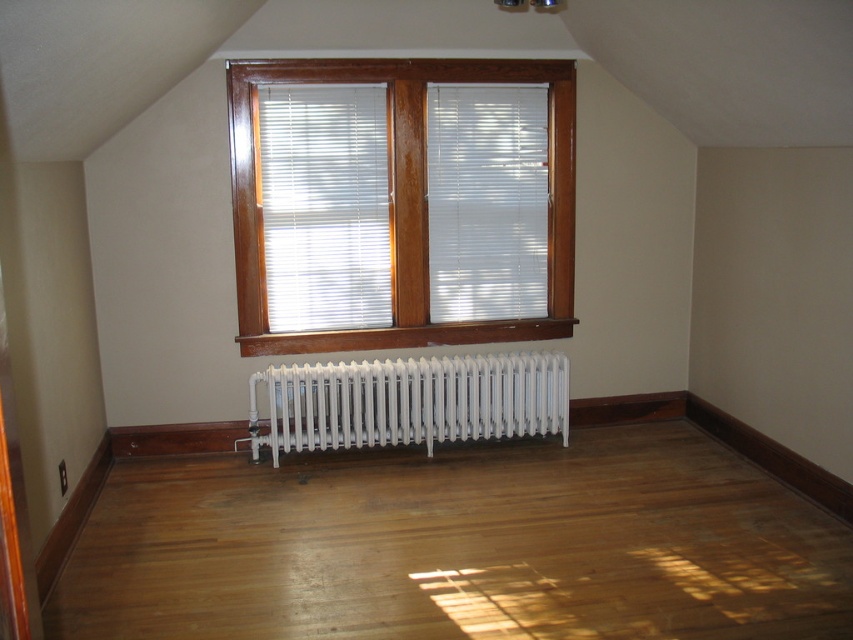
Question: Based on their relative distances, which object is farther from the shiny brown hardwood floor at center?

Choices:
 (A) white metallic radiator at center
 (B) white wood blinds at center

Answer: (B)

Question: Which object is closer to the camera taking this photo?

Choices:
 (A) white wood blinds at center
 (B) white metallic radiator at center

Answer: (A)

Question: Observing the image, what is the correct spatial positioning of shiny brown hardwood floor at center in reference to white wood blinds at center?

Choices:
 (A) below
 (B) above

Answer: (A)

Question: Does shiny brown hardwood floor at center come behind white wood blinds at center?

Choices:
 (A) yes
 (B) no

Answer: (B)

Question: Is shiny brown hardwood floor at center wider than white wood blinds at center?

Choices:
 (A) yes
 (B) no

Answer: (A)

Question: Among these objects, which one is farthest from the camera?

Choices:
 (A) white wood blinds at center
 (B) shiny brown hardwood floor at center

Answer: (A)